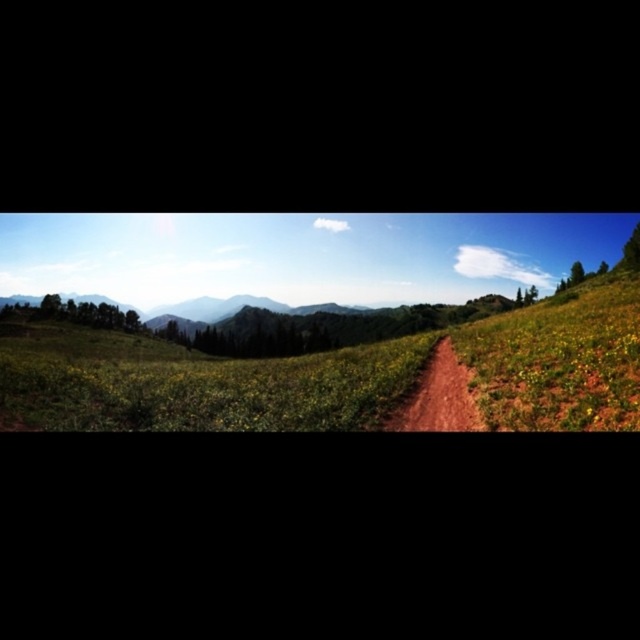
Is point (90, 376) more distant than point (444, 400)?

Yes, point (90, 376) is farther from viewer.

Can you confirm if green grassy field at center is shorter than brown dirt track at center?

Incorrect, green grassy field at center's height does not fall short of brown dirt track at center's.

Locate an element on the screen. The height and width of the screenshot is (640, 640). green grassy field at center is located at coordinates (196, 385).

This screenshot has height=640, width=640. In order to click on green grassy field at center in this screenshot , I will do `click(196, 385)`.